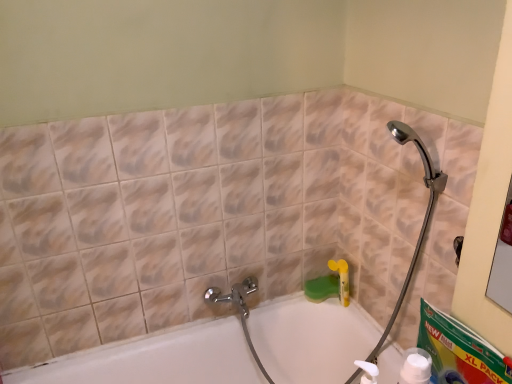
What do you see at coordinates (156, 359) in the screenshot? I see `white glossy bathtub at center` at bounding box center [156, 359].

Image resolution: width=512 pixels, height=384 pixels. I want to click on white glossy bathtub at center, so click(156, 359).

Describe the element at coordinates (416, 367) in the screenshot. I see `white plastic bottle at lower right` at that location.

What are the coordinates of `white plastic bottle at lower right` in the screenshot? It's located at (416, 367).

The width and height of the screenshot is (512, 384). I want to click on white glossy bathtub at center, so click(156, 359).

Between white plastic bottle at lower right and white glossy bathtub at center, which one appears on the left side from the viewer's perspective?

From the viewer's perspective, white glossy bathtub at center appears more on the left side.

Is the depth of white plastic bottle at lower right greater than that of white glossy bathtub at center?

No, white plastic bottle at lower right is closer to the viewer.

Is point (416, 373) closer to viewer compared to point (80, 368)?

Yes, point (416, 373) is in front of point (80, 368).

From the image's perspective, who appears lower, white plastic bottle at lower right or white glossy bathtub at center?

white glossy bathtub at center, from the image's perspective.

From a real-world perspective, does white plastic bottle at lower right sit lower than white glossy bathtub at center?

No.

Does white plastic bottle at lower right have a greater width compared to white glossy bathtub at center?

In fact, white plastic bottle at lower right might be narrower than white glossy bathtub at center.

Considering the relative sizes of white plastic bottle at lower right and white glossy bathtub at center in the image provided, is white plastic bottle at lower right shorter than white glossy bathtub at center?

Correct, white plastic bottle at lower right is not as tall as white glossy bathtub at center.

Considering the sizes of objects white plastic bottle at lower right and white glossy bathtub at center in the image provided, who is bigger, white plastic bottle at lower right or white glossy bathtub at center?

With larger size is white glossy bathtub at center.

Is white plastic bottle at lower right outside of white glossy bathtub at center?

Yes.

Is the surface of white plastic bottle at lower right in direct contact with white glossy bathtub at center?

white plastic bottle at lower right and white glossy bathtub at center are not in contact.

Is white glossy bathtub at center at the back of white plastic bottle at lower right?

That's not correct — white plastic bottle at lower right is not looking away from white glossy bathtub at center.

How different are the orientations of white plastic bottle at lower right and white glossy bathtub at center in degrees?

They differ by 86.3 degrees in their facing directions.

Identify the location of cleaning product to the right of white glossy bathtub at center. This screenshot has width=512, height=384. (416, 367).

Considering the relative positions of white glossy bathtub at center and white plastic bottle at lower right in the image provided, is white glossy bathtub at center to the left or to the right of white plastic bottle at lower right?

In the image, white glossy bathtub at center appears on the left side of white plastic bottle at lower right.

Is white glossy bathtub at center closer to camera compared to white plastic bottle at lower right?

No, it is behind white plastic bottle at lower right.

Is point (8, 383) positioned in front of point (424, 378)?

That is False.

From the image's perspective, is white glossy bathtub at center located beneath white plastic bottle at lower right?

Yes.

From a real-world perspective, is white glossy bathtub at center physically below white plastic bottle at lower right?

Yes, from a real-world perspective, white glossy bathtub at center is below white plastic bottle at lower right.

Can you confirm if white glossy bathtub at center is wider than white plastic bottle at lower right?

Indeed, white glossy bathtub at center has a greater width compared to white plastic bottle at lower right.

From their relative heights in the image, would you say white glossy bathtub at center is taller or shorter than white plastic bottle at lower right?

white glossy bathtub at center is taller than white plastic bottle at lower right.

Is white glossy bathtub at center bigger than white plastic bottle at lower right?

Indeed, white glossy bathtub at center has a larger size compared to white plastic bottle at lower right.

Would you say white glossy bathtub at center contains white plastic bottle at lower right?

No, white plastic bottle at lower right is not surrounded by white glossy bathtub at center.

Are white glossy bathtub at center and white plastic bottle at lower right located far from each other?

white glossy bathtub at center is near white plastic bottle at lower right, not far away.

Is white glossy bathtub at center oriented towards white plastic bottle at lower right?

No, white glossy bathtub at center does not turn towards white plastic bottle at lower right.

How different are the orientations of white glossy bathtub at center and white plastic bottle at lower right in degrees?

86.3 degrees.

I want to click on bathtub below the white plastic bottle at lower right (from a real-world perspective), so click(x=156, y=359).

At what (x,y) coordinates should I click in order to perform the action: click on bathtub below the white plastic bottle at lower right (from the image's perspective). Please return your answer as a coordinate pair (x, y). The height and width of the screenshot is (384, 512). Looking at the image, I should click on (156, 359).

Image resolution: width=512 pixels, height=384 pixels. I want to click on bathtub on the left of white plastic bottle at lower right, so click(156, 359).